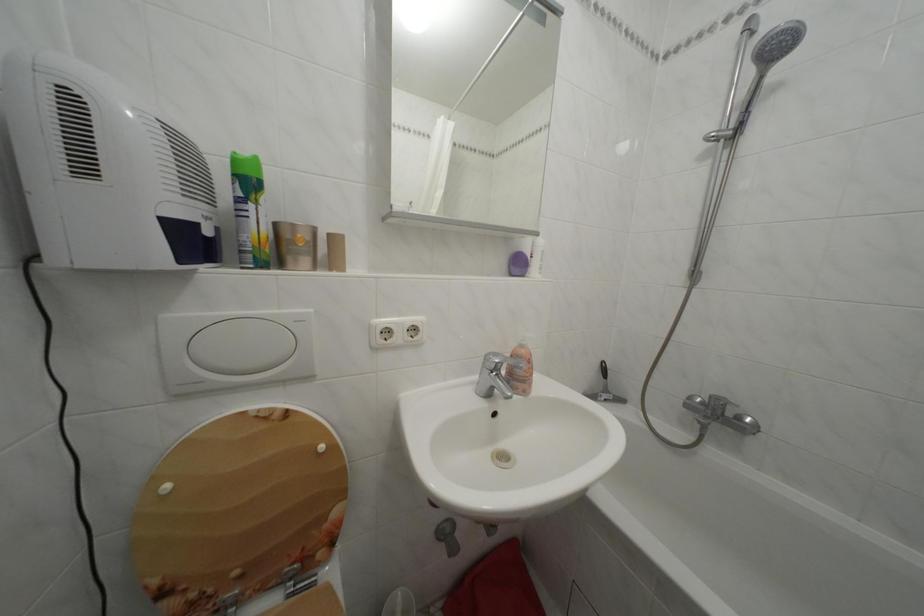
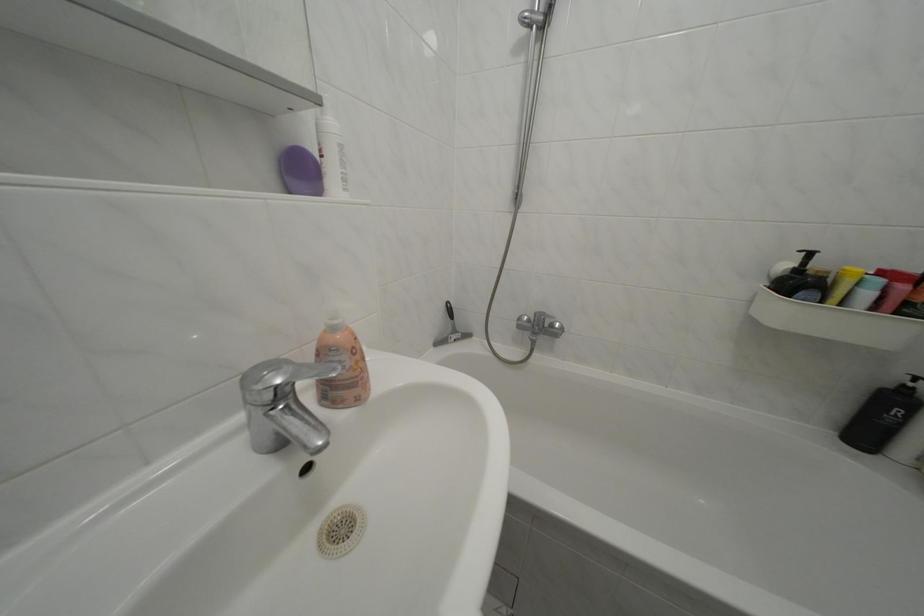
Find the pixel in the second image that matches point (530, 352) in the first image.

(342, 334)